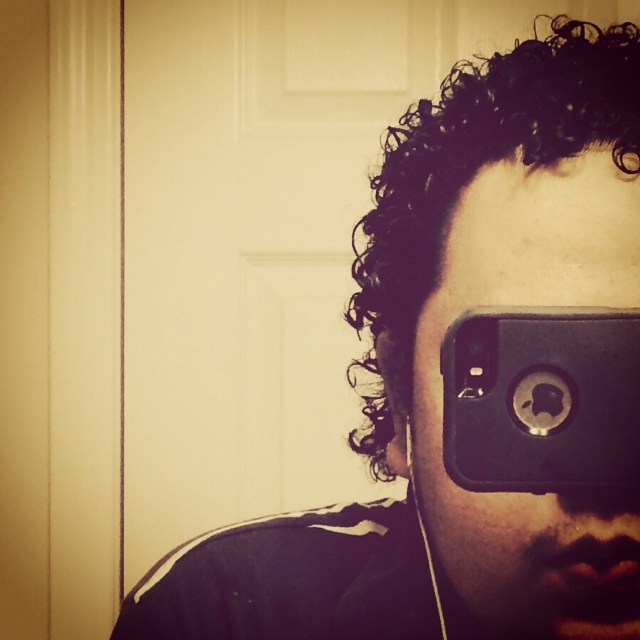
You are holding a black matte phone at center and want to take a selfie. The recommended distance for a clear photo is 12 inches. Is your current distance within the recommended range?

The distance between the black matte phone at center and the viewer is 12.81 inches, which is slightly beyond the recommended 12 inches for a clear selfie. Move the phone closer to within 12 inches for better results.

You are a photographer trying to capture a closeup of the person taking a selfie. You need to focus on the phone that is closer to you. Which phone should you focus on between the black matte phone at center and the black rubberized phone at center?

The black matte phone at center is closer to you, so you should focus on the black matte phone at center.

You are trying to choose between two phones displayed in the image. The black matte phone at center and the black rubberized phone at center. Which one is taller?

The black matte phone at center is much taller than the black rubberized phone at center.